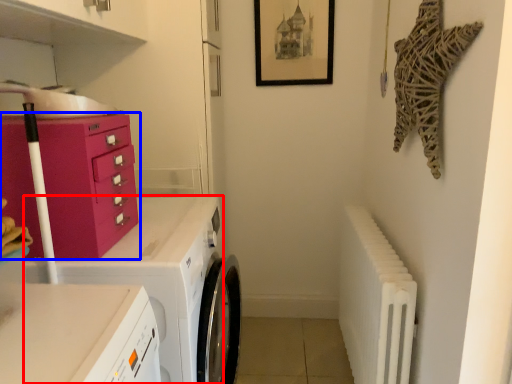
Question: Which object appears farthest to the camera in this image, home appliance (highlighted by a red box) or chest of drawers (highlighted by a blue box)?

Choices:
 (A) home appliance
 (B) chest of drawers

Answer: (A)